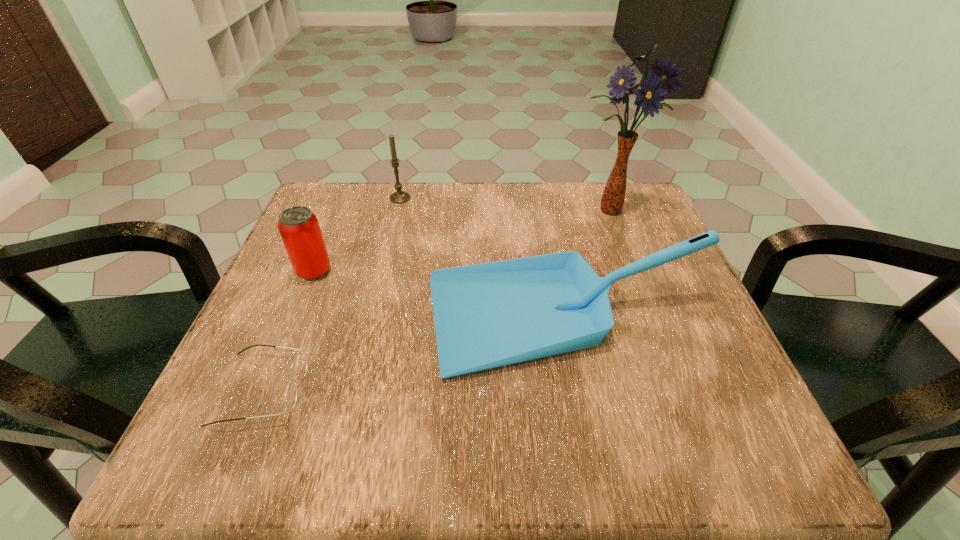
What are the coordinates of `flower arrangement` in the screenshot? It's located at (649, 97).

What are the coordinates of `candle` in the screenshot? It's located at (399, 196).

Find the location of `dustpan`. dustpan is located at coordinates (487, 315).

This screenshot has height=540, width=960. I want to click on can, so click(299, 228).

The image size is (960, 540). Identify the location of the shortest object. (291, 393).

Identify the location of free region located 0.400m on the left of the flower arrangement. (407, 211).

Locate an element on the screen. vacant space located on the front of the third object from left to right is located at coordinates (375, 301).

In order to click on free space located 0.100m on the back of the dustpan in this screenshot , I will do `click(551, 240)`.

This screenshot has height=540, width=960. Identify the location of free space located on the right of the can. (410, 271).

I want to click on free space located 0.120m through the lenses of the shortest object, so click(x=378, y=388).